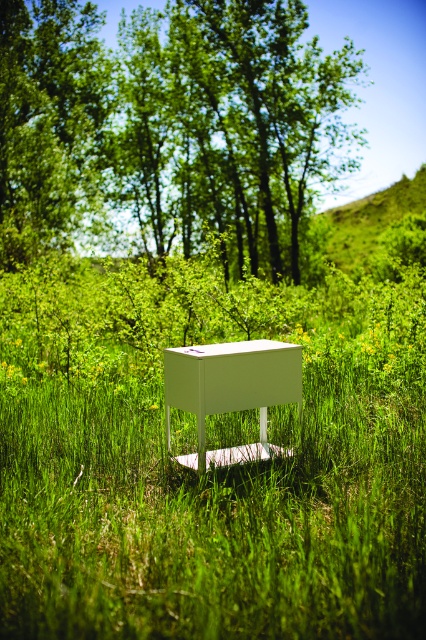
Question: Among these points, which one is farthest from the camera?

Choices:
 (A) (310, 189)
 (B) (2, 24)
 (C) (255, 356)

Answer: (A)

Question: Is green leafy trees at upper center above green leafy tree at upper center?

Choices:
 (A) yes
 (B) no

Answer: (B)

Question: Which point is farther from the camera taking this photo?

Choices:
 (A) (218, 404)
 (B) (57, 0)

Answer: (B)

Question: Can you confirm if green leafy tree at upper center is positioned to the left of white matte table at center?

Choices:
 (A) yes
 (B) no

Answer: (A)

Question: Can you confirm if green leafy tree at upper center is positioned to the right of white matte table at center?

Choices:
 (A) yes
 (B) no

Answer: (B)

Question: Which of the following is the farthest from the observer?

Choices:
 (A) green leafy trees at upper center
 (B) green leafy tree at upper center
 (C) white matte table at center

Answer: (B)